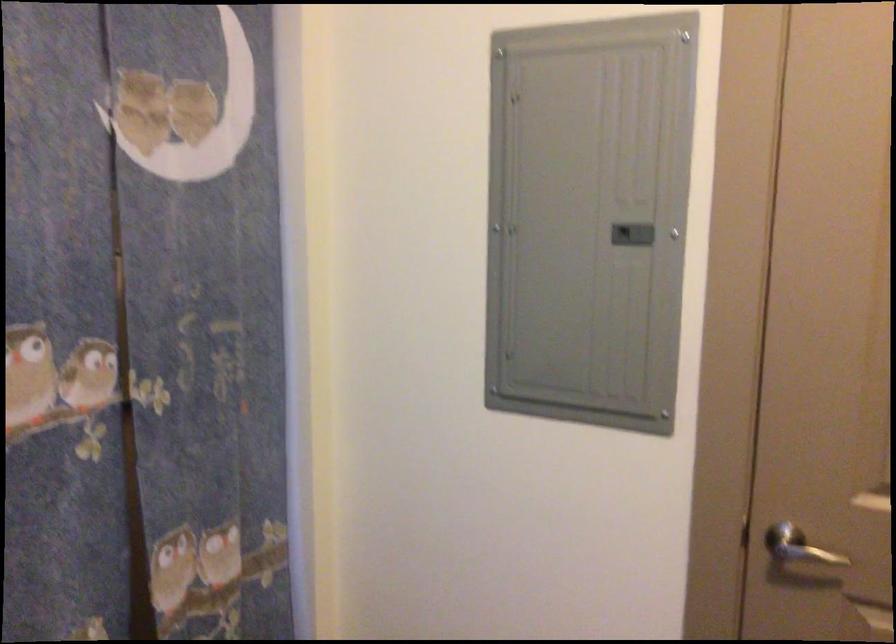
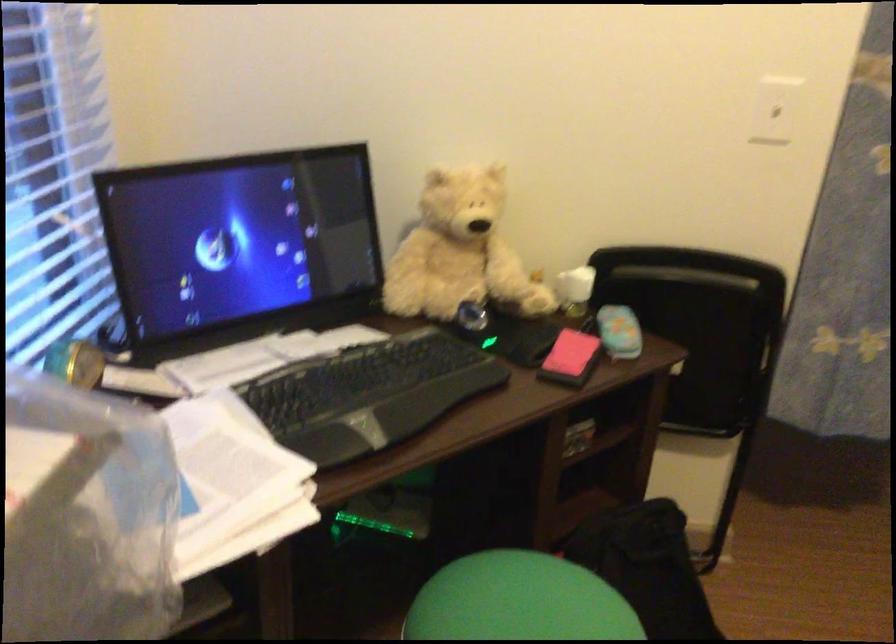
How did the camera likely rotate?

The camera's rotation is toward left-down.